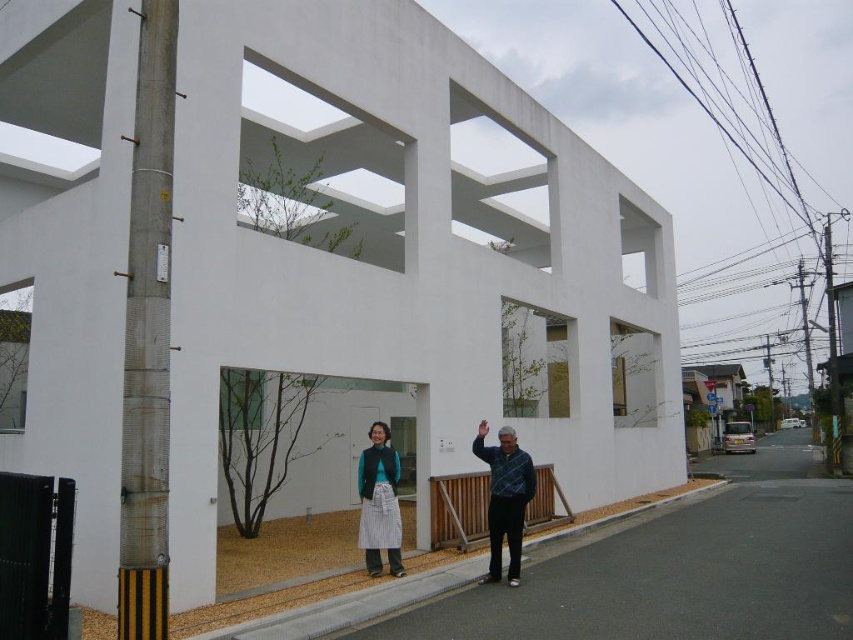
Who is higher up, blue plaid shirt at lower right or striped fabric skirt at center?

Positioned higher is blue plaid shirt at lower right.

Does point (527, 484) come in front of point (363, 500)?

That is True.

This screenshot has width=853, height=640. In order to click on blue plaid shirt at lower right in this screenshot , I will do `click(505, 499)`.